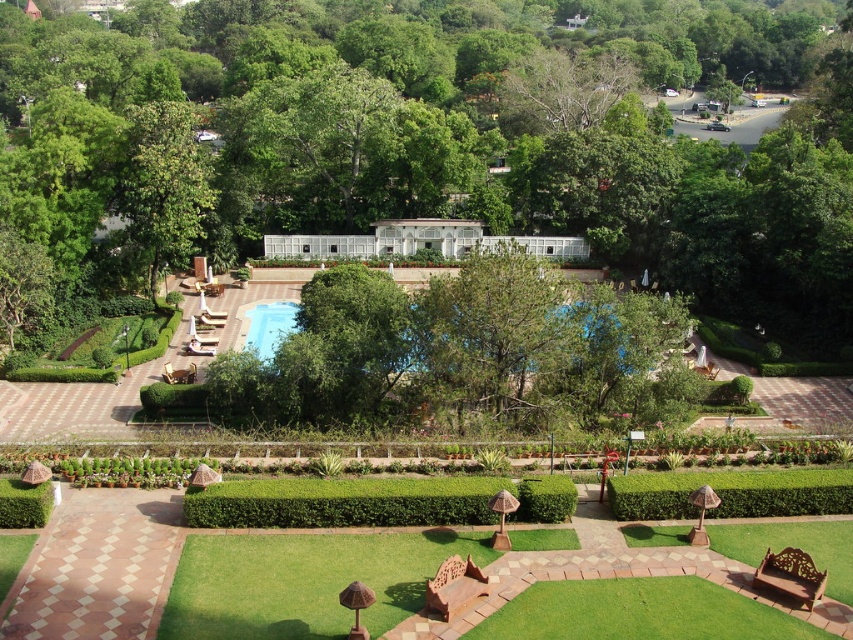
How much distance is there between green leafy hedge at center and green leafy tree at upper left?

The distance of green leafy hedge at center from green leafy tree at upper left is 40.12 meters.

Is the position of green leafy hedge at center more distant than that of green leafy tree at upper left?

No, it is not.

Describe the element at coordinates (374, 500) in the screenshot. I see `green leafy hedge at center` at that location.

Locate an element on the screen. This screenshot has width=853, height=640. green leafy hedge at center is located at coordinates (374, 500).

From the picture: Between green leafy tree at center and green leafy hedge at center, which one is positioned higher?

green leafy tree at center

Which of these two, green leafy tree at center or green leafy hedge at center, stands taller?

With more height is green leafy tree at center.

Is point (210, 108) closer to camera compared to point (293, 484)?

No, it is not.

The image size is (853, 640). In order to click on green leafy tree at center in this screenshot , I will do `click(440, 141)`.

Does green leafy tree at center have a lesser width compared to transparent glass pool at center?

No.

Can you confirm if green leafy tree at center is bigger than transparent glass pool at center?

Yes.

Does point (401, 33) lie in front of point (264, 305)?

No, (401, 33) is further to viewer.

Find the location of a particular element. Image resolution: width=853 pixels, height=640 pixels. green leafy tree at center is located at coordinates (440, 141).